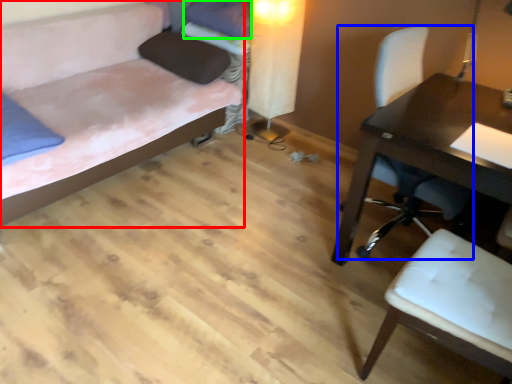
Question: Considering the real-world distances, which object is closest to bed (highlighted by a red box)? chair (highlighted by a blue box) or pillow (highlighted by a green box).

Choices:
 (A) chair
 (B) pillow

Answer: (B)